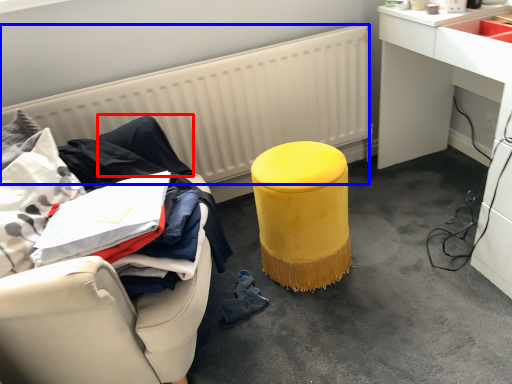
Question: Among these objects, which one is nearest to the camera, clothing (highlighted by a red box) or radiator (highlighted by a blue box)?

Choices:
 (A) clothing
 (B) radiator

Answer: (A)